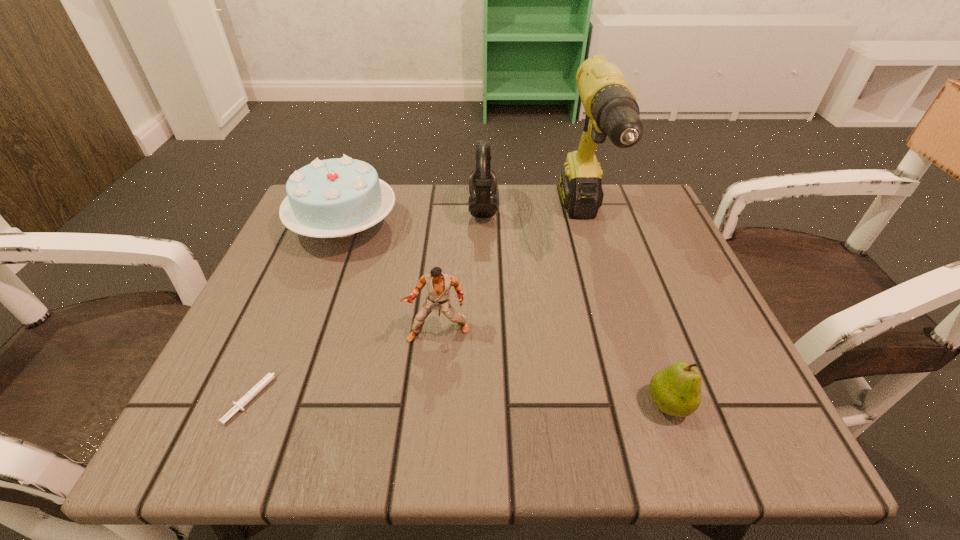
Where is `free space between the pear and the drill`? free space between the pear and the drill is located at coordinates (627, 315).

The width and height of the screenshot is (960, 540). I want to click on the fifth closest object to the tallest object, so click(x=238, y=405).

Identify the location of object that is the fourth closest to the headset. This screenshot has height=540, width=960. (x=676, y=390).

Where is `free spot that satisfies the following two spatial constraints: 1. on the earcups of the headset; 2. on the left side of the fifth tallest object`? The height and width of the screenshot is (540, 960). free spot that satisfies the following two spatial constraints: 1. on the earcups of the headset; 2. on the left side of the fifth tallest object is located at coordinates (485, 404).

You are a GUI agent. You are given a task and a screenshot of the screen. Output one action in this format:
    pyautogui.click(x=<x>, y=<y>)
    Task: Click on the vacant region that satisfies the following two spatial constraints: 1. on the earcups of the headset; 2. on the back side of the second shortest object
    
    Given the screenshot: What is the action you would take?
    click(x=485, y=404)

Where is `free space that satisfies the following two spatial constraints: 1. on the earcups of the headset; 2. on the left side of the second shortest object`? The image size is (960, 540). free space that satisfies the following two spatial constraints: 1. on the earcups of the headset; 2. on the left side of the second shortest object is located at coordinates (485, 404).

This screenshot has height=540, width=960. Find the location of `vacant space that satisfies the following two spatial constraints: 1. on the earcups of the headset; 2. on the front-facing side of the puncher`. vacant space that satisfies the following two spatial constraints: 1. on the earcups of the headset; 2. on the front-facing side of the puncher is located at coordinates (484, 332).